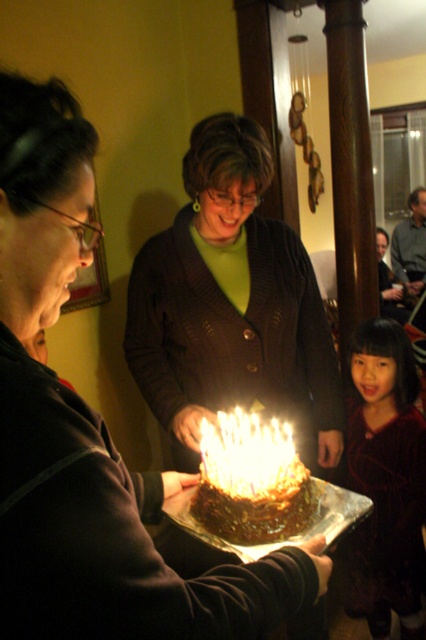
Question: Considering the real-world distances, which object is farthest from the golden wax candle at center?

Choices:
 (A) velvet dark dress at lower right
 (B) matte brown sweater at center
 (C) dark brown sweater at center

Answer: (A)

Question: Based on their relative distances, which object is nearer to the matte brown sweater at center?

Choices:
 (A) golden wax candle at center
 (B) chocolate frosted cake at center

Answer: (B)

Question: From the image, what is the correct spatial relationship of velvet dark dress at lower right in relation to golden wax candle at center?

Choices:
 (A) below
 (B) above

Answer: (A)

Question: Which point is farther to the camera?

Choices:
 (A) velvet dark dress at lower right
 (B) golden wax candle at center
 (C) chocolate frosted cake at center

Answer: (A)

Question: Is dark brown sweater at center closer to the viewer compared to golden wax candle at center?

Choices:
 (A) no
 (B) yes

Answer: (A)

Question: Does matte brown sweater at center have a smaller size compared to dark brown sweater at center?

Choices:
 (A) yes
 (B) no

Answer: (A)